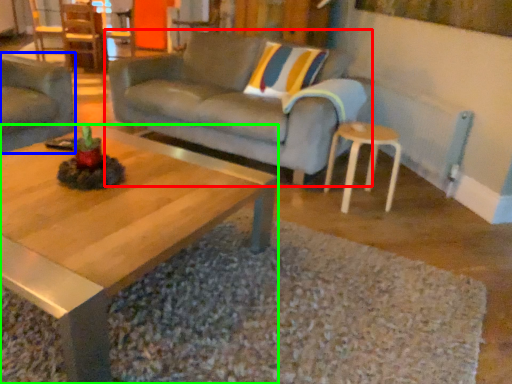
Question: Which object is positioned closest to studio couch (highlighted by a red box)? Select from studio couch (highlighted by a blue box) and coffee table (highlighted by a green box).

Choices:
 (A) studio couch
 (B) coffee table

Answer: (A)